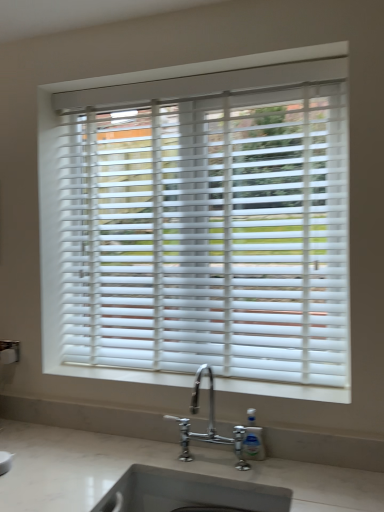
Question: Considering the positions of white matte window sill at center and white matte blinds at center in the image, is white matte window sill at center taller or shorter than white matte blinds at center?

Choices:
 (A) tall
 (B) short

Answer: (B)

Question: From a real-world perspective, is white matte window sill at center positioned above or below white matte blinds at center?

Choices:
 (A) above
 (B) below

Answer: (B)

Question: Which object is the farthest from the chrome metallic faucet at lower center?

Choices:
 (A) white matte blinds at center
 (B) white matte window sill at center
 (C) white marble sink at lower center
 (D) clear plastic soap dispenser at lower center

Answer: (A)

Question: Which of these objects is positioned closest to the white matte blinds at center?

Choices:
 (A) chrome metallic faucet at lower center
 (B) white marble sink at lower center
 (C) clear plastic soap dispenser at lower center
 (D) white matte window sill at center

Answer: (D)